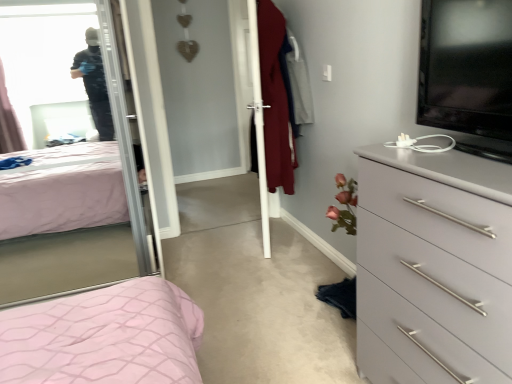
You are a GUI agent. You are given a task and a screenshot of the screen. Output one action in this format:
    pyautogui.click(x=<x>, y=<y>)
    Task: Click on the free spot below white glossy screen door at center (from a real-world perspective)
    
    Given the screenshot: What is the action you would take?
    pyautogui.click(x=269, y=238)